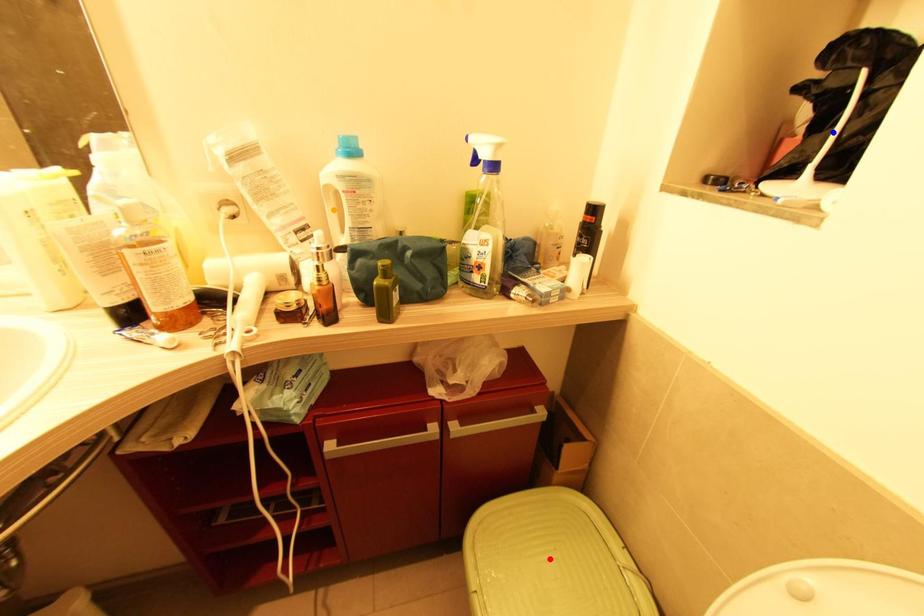
Order these from nearest to farthest:
red point
orange point
blue point

blue point, orange point, red point